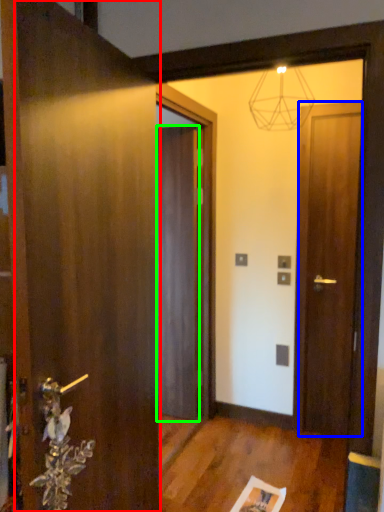
Question: Which object is the farthest from door (highlighted by a red box)? Choose among these: door (highlighted by a blue box) or door (highlighted by a green box).

Choices:
 (A) door
 (B) door

Answer: (A)